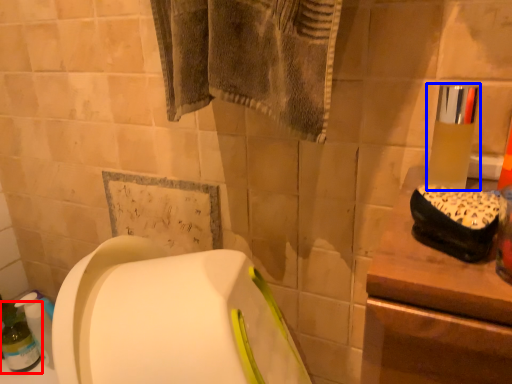
Question: Which object is closer to the camera taking this photo, bottle (highlighted by a red box) or mouthwash (highlighted by a blue box)?

Choices:
 (A) bottle
 (B) mouthwash

Answer: (B)